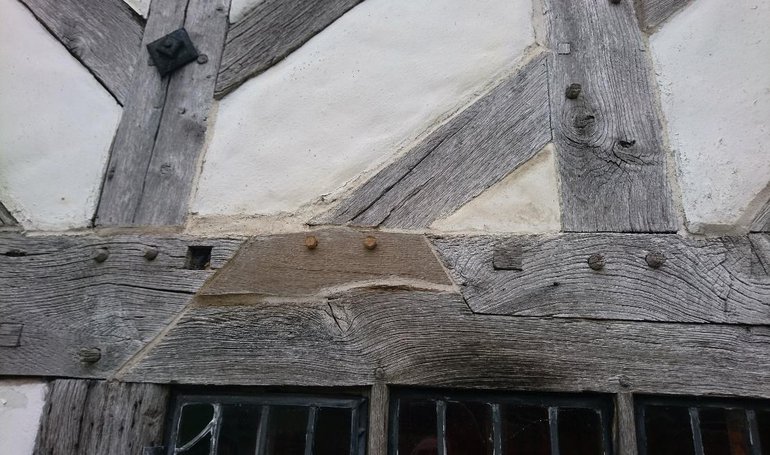
Locate an element on the screen. wall is located at coordinates (48, 142), (290, 105), (735, 107).